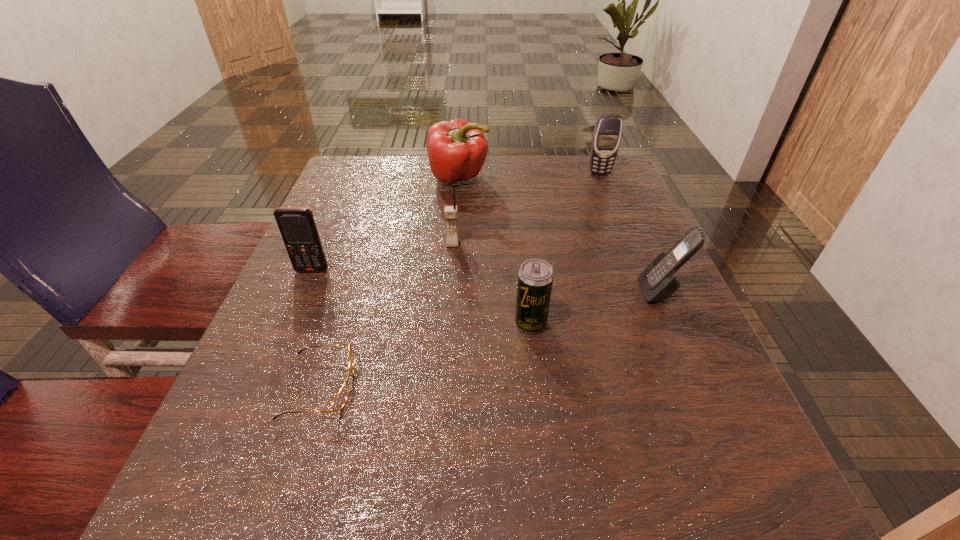
This screenshot has width=960, height=540. In the image, there is a desktop. What are the coordinates of `vacant region at the far right corner` in the screenshot? It's located at (574, 169).

In order to click on free space at the near right corner of the desktop in this screenshot , I will do `click(753, 491)`.

Identify the location of free space between the beer can and the fourth nearest object. The height and width of the screenshot is (540, 960). (421, 297).

Where is `vacant region between the sixth farthest object and the farthest cellular telephone`? The image size is (960, 540). vacant region between the sixth farthest object and the farthest cellular telephone is located at coordinates (565, 248).

Locate an element on the screen. This screenshot has height=540, width=960. vacant space in between the nearest cellular telephone and the sixth object from right to left is located at coordinates (490, 339).

You are a GUI agent. You are given a task and a screenshot of the screen. Output one action in this format:
    pyautogui.click(x=<x>, y=<y>)
    Task: Click on the empty space that is in between the farthest cellular telephone and the third nearest cellular telephone
    
    Given the screenshot: What is the action you would take?
    pyautogui.click(x=526, y=208)

The height and width of the screenshot is (540, 960). What are the coordinates of `vacant region between the farthest cellular telephone and the nearest object` in the screenshot? It's located at [x=460, y=280].

I want to click on vacant space in between the fifth object from left to right and the leftmost object, so click(x=421, y=297).

Where is `free space between the nearest object and the nearest cellular telephone`? free space between the nearest object and the nearest cellular telephone is located at coordinates coord(490,339).

At what (x,y) coordinates should I click in order to perform the action: click on unoccupied position between the second object from left to right and the farthest cellular telephone. Please return your answer as a coordinate pair (x, y). This screenshot has height=540, width=960. Looking at the image, I should click on (460, 280).